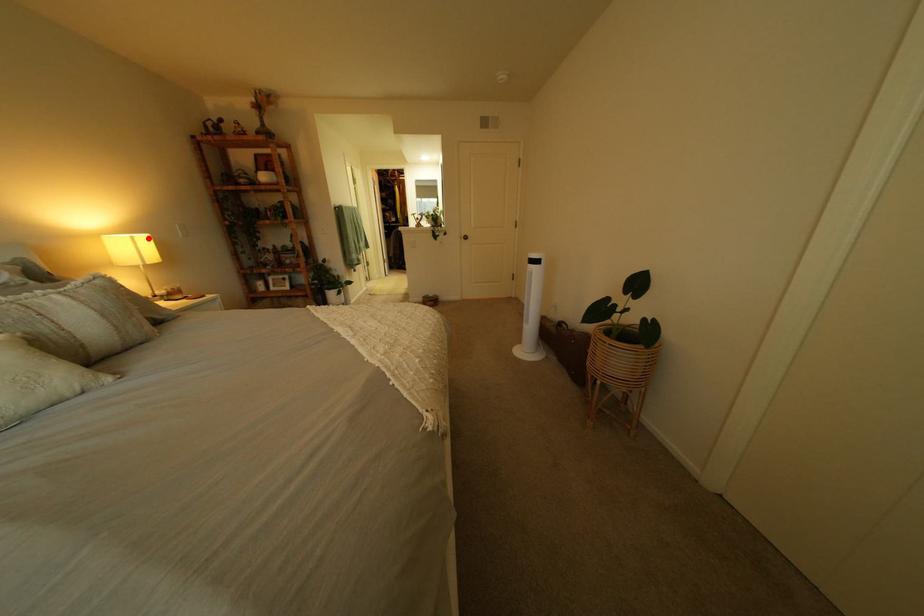
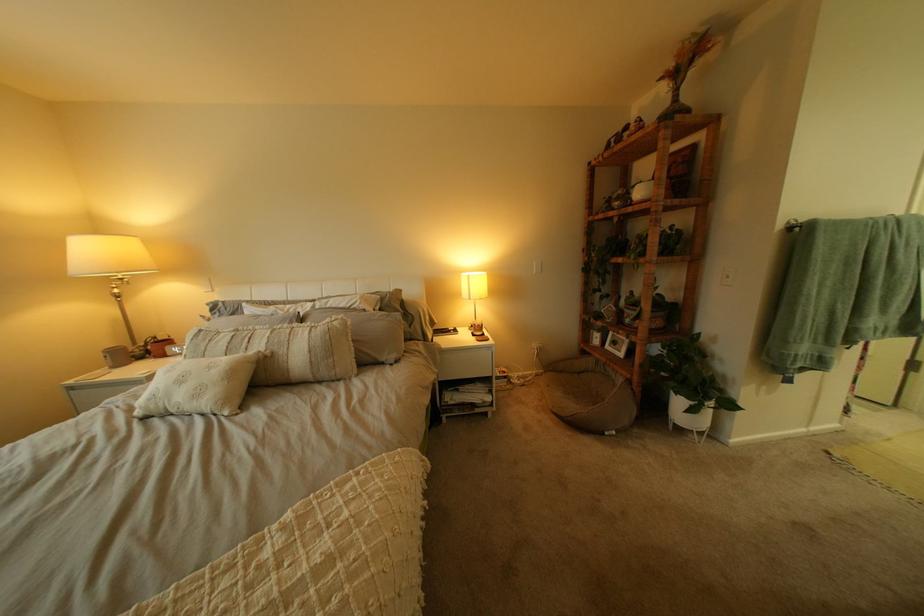
The point at the highlighted location is marked in the first image. Where is the corresponding point in the second image?

(483, 277)